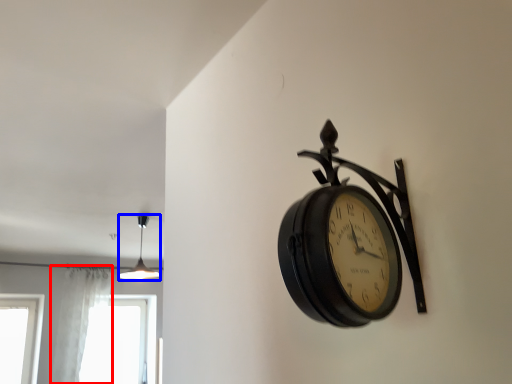
Question: Which point is closer to the camera, curtain (highlighted by a red box) or lamp (highlighted by a blue box)?

Choices:
 (A) curtain
 (B) lamp

Answer: (B)